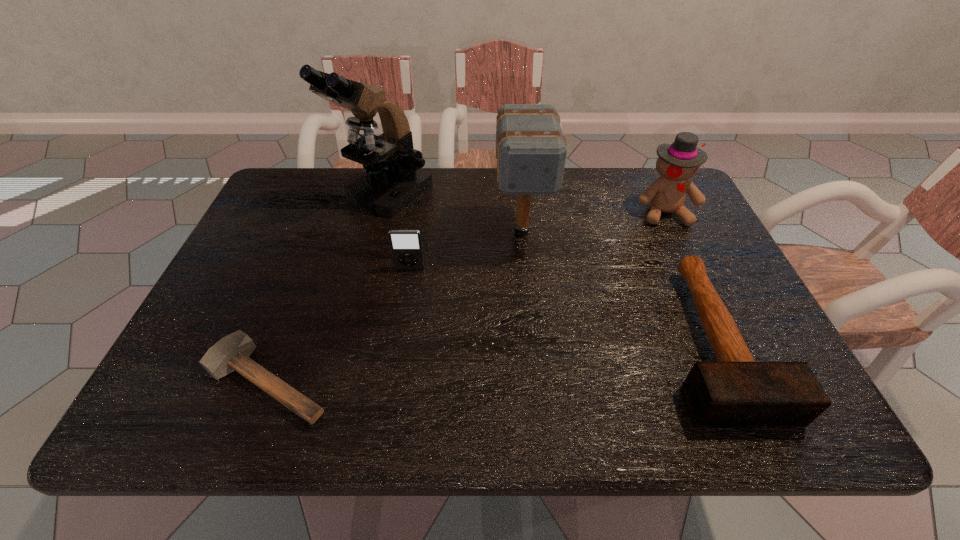
The image size is (960, 540). I want to click on mallet that is at the right edge, so click(x=736, y=391).

The image size is (960, 540). I want to click on object at the near left corner, so click(x=232, y=352).

Identify the location of object that is at the far right corner. Image resolution: width=960 pixels, height=540 pixels. (677, 162).

Locate an element on the screen. The width and height of the screenshot is (960, 540). object that is at the near right corner is located at coordinates (736, 391).

Where is `free space at the far edge of the desktop`? Image resolution: width=960 pixels, height=540 pixels. free space at the far edge of the desktop is located at coordinates (475, 198).

Locate an element on the screen. The image size is (960, 540). blank space at the near edge of the desktop is located at coordinates (443, 395).

Identify the location of vacant space at the left edge. (276, 216).

In order to click on vacant space at the right edge of the desktop in this screenshot , I will do `click(726, 303)`.

Where is `vacant space at the far left corner of the desktop`? The height and width of the screenshot is (540, 960). vacant space at the far left corner of the desktop is located at coordinates (296, 201).

The height and width of the screenshot is (540, 960). Find the location of `free space at the near left corner`. free space at the near left corner is located at coordinates (238, 404).